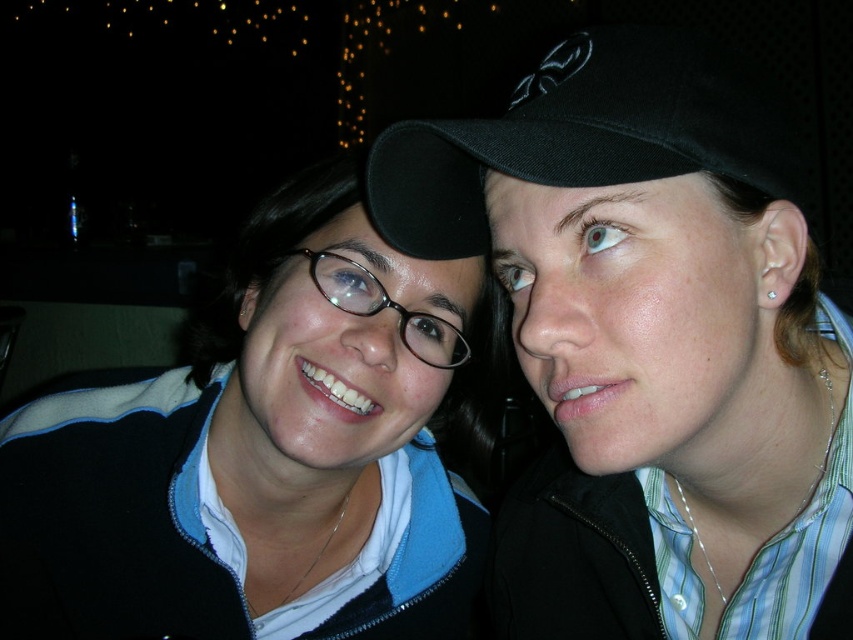
Is black matte cap at upper right above black matte baseball cap at upper center?

No, black matte cap at upper right is not above black matte baseball cap at upper center.

Does black matte cap at upper right appear on the left side of black matte baseball cap at upper center?

No, black matte cap at upper right is not to the left of black matte baseball cap at upper center.

This screenshot has width=853, height=640. Find the location of `black matte cap at upper right`. black matte cap at upper right is located at coordinates (659, 348).

Image resolution: width=853 pixels, height=640 pixels. Describe the element at coordinates (265, 449) in the screenshot. I see `matte black jacket at center` at that location.

Who is lower down, matte black jacket at center or black matte baseball cap at upper center?

matte black jacket at center is lower down.

Between point (221, 589) and point (585, 45), which one is positioned in front?

Point (585, 45) is in front.

This screenshot has width=853, height=640. I want to click on matte black jacket at center, so click(x=265, y=449).

Does black matte baseball cap at upper center come behind matte black glasses at center?

That is False.

Is black matte baseball cap at upper center shorter than matte black glasses at center?

No, black matte baseball cap at upper center is not shorter than matte black glasses at center.

Find the location of `black matte baseball cap at upper center`. black matte baseball cap at upper center is located at coordinates point(585,134).